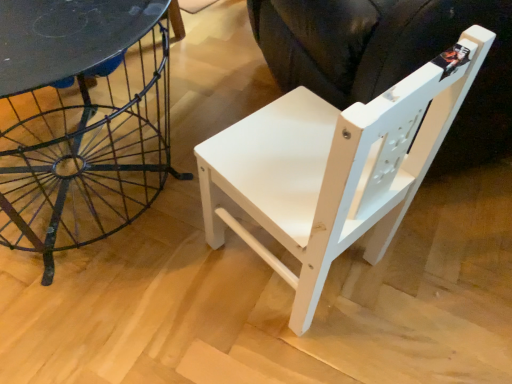
Measure the distance between point (11,10) and camera.

They are 25.63 inches apart.

In order to face metallic black table at left, should I rotate leftwards or rightwards?

To align with it, rotate left about 23.449°.

The image size is (512, 384). Identify the location of white matte wood chair at center. (333, 168).

Is white matte wood chair at center positioned far away from matte black table at left?

No, there isn't a large distance between white matte wood chair at center and matte black table at left.

Does white matte wood chair at center contain matte black table at left?

No, white matte wood chair at center does not contain matte black table at left.

Looking at this image, from a real-world perspective, which object rests below the other?

matte black table at left, from a real-world perspective.

Where is `round table that is behind the white matte wood chair at center`? round table that is behind the white matte wood chair at center is located at coordinates (66, 37).

Is white matte wood swivel chair at center wider than metallic black table at left?

Indeed, white matte wood swivel chair at center has a greater width compared to metallic black table at left.

Which of these two, white matte wood swivel chair at center or metallic black table at left, is bigger?

white matte wood swivel chair at center.

You are a GUI agent. You are given a task and a screenshot of the screen. Output one action in this format:
    pyautogui.click(x=<x>, y=<y>)
    Task: Click on the swivel chair that is above the metallic black table at left (from a real-world perspective)
    
    Given the screenshot: What is the action you would take?
    pyautogui.click(x=392, y=59)

Is white matte wood swivel chair at center touching metallic black table at left?

white matte wood swivel chair at center is not next to metallic black table at left, and they're not touching.

From a real-world perspective, between metallic black table at left and matte black table at left, who is vertically higher?

metallic black table at left is physically above.

Looking at this image, from the image's perspective, is metallic black table at left located above matte black table at left?

No.

Considering the positions of points (156, 36) and (42, 13), is point (156, 36) closer to camera compared to point (42, 13)?

No.

Identify the location of table in front of the matte black table at left. click(x=81, y=119).

Which object is further away from the camera, metallic black table at left or white matte wood chair at center?

metallic black table at left is further away from the camera.

Is point (27, 94) closer to camera compared to point (309, 92)?

That is False.

From a real-world perspective, is metallic black table at left below white matte wood chair at center?

Yes, from a real-world perspective, metallic black table at left is beneath white matte wood chair at center.

Is metallic black table at left positioned with its back to white matte wood chair at center?

Absolutely, metallic black table at left is directed away from white matte wood chair at center.

Is matte black table at left smaller than white matte wood swivel chair at center?

Correct, matte black table at left occupies less space than white matte wood swivel chair at center.

Is matte black table at left not near white matte wood swivel chair at center?

Actually, matte black table at left and white matte wood swivel chair at center are a little close together.

Considering the points (61, 44) and (481, 69), which point is behind, point (61, 44) or point (481, 69)?

The point (481, 69) is behind.

Is the depth of matte black table at left greater than that of white matte wood swivel chair at center?

Yes, matte black table at left is further from the viewer.

Do you think white matte wood chair at center is within metallic black table at left, or outside of it?

white matte wood chair at center is located beyond the bounds of metallic black table at left.

Is white matte wood chair at center wider than metallic black table at left?

No, white matte wood chair at center is not wider than metallic black table at left.

From a real-world perspective, which is physically below, white matte wood chair at center or metallic black table at left?

metallic black table at left is physically lower.

Is matte black table at left next to white matte wood chair at center and touching it?

They are not placed beside each other.

Which object is wider, matte black table at left or white matte wood chair at center?

white matte wood chair at center is wider.

Is white matte wood chair at center a part of matte black table at left?

No, white matte wood chair at center is located outside of matte black table at left.

Where is `chair in front of the matte black table at left`? chair in front of the matte black table at left is located at coordinates (333, 168).

You are a GUI agent. You are given a task and a screenshot of the screen. Output one action in this format:
    pyautogui.click(x=<x>, y=<y>)
    Task: Click on the table that is under the white matte wood swivel chair at center (from a real-world perspective)
    This screenshot has width=512, height=384.
    Given the screenshot: What is the action you would take?
    pyautogui.click(x=81, y=119)

Estimate the real-world distances between objects in this image. Which object is further from matte black table at left, white matte wood swivel chair at center or white matte wood chair at center?

The object further to matte black table at left is white matte wood swivel chair at center.

From the image, which object appears to be farther from white matte wood swivel chair at center, matte black table at left or white matte wood chair at center?

matte black table at left is positioned further to the anchor white matte wood swivel chair at center.

Considering their positions, is white matte wood chair at center positioned closer to matte black table at left than metallic black table at left?

metallic black table at left is positioned closer to the anchor matte black table at left.

From the image, which object appears to be farther from matte black table at left, metallic black table at left or white matte wood chair at center?

white matte wood chair at center.

Estimate the real-world distances between objects in this image. Which object is closer to white matte wood swivel chair at center, metallic black table at left or white matte wood chair at center?

white matte wood chair at center lies closer to white matte wood swivel chair at center than the other object.

Estimate the real-world distances between objects in this image. Which object is closer to white matte wood chair at center, metallic black table at left or white matte wood swivel chair at center?

Among the two, white matte wood swivel chair at center is located nearer to white matte wood chair at center.

Which object lies nearer to the anchor point matte black table at left, white matte wood chair at center or white matte wood swivel chair at center?

The object closer to matte black table at left is white matte wood chair at center.

Based on their spatial positions, is matte black table at left or metallic black table at left further from white matte wood swivel chair at center?

metallic black table at left is further to white matte wood swivel chair at center.

Locate an element on the screen. chair between metallic black table at left and white matte wood swivel chair at center is located at coordinates (333, 168).

In order to click on table between white matte wood chair at center and matte black table at left in the front-back direction in this screenshot , I will do `click(81, 119)`.

Where is `chair between matte black table at left and white matte wood swivel chair at center in the horizontal direction`? chair between matte black table at left and white matte wood swivel chair at center in the horizontal direction is located at coordinates (333, 168).

This screenshot has width=512, height=384. I want to click on round table located between metallic black table at left and white matte wood swivel chair at center in the left-right direction, so click(66, 37).